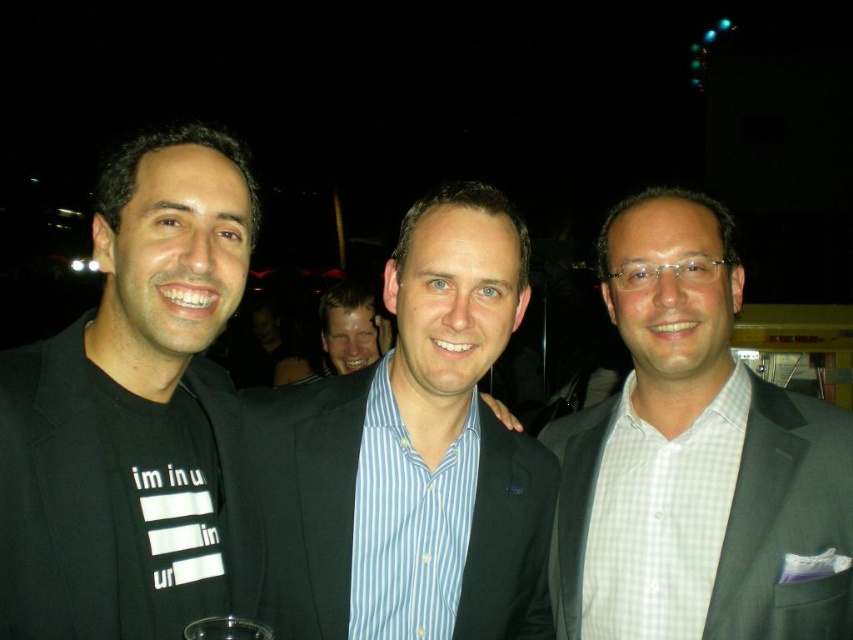
Question: Does black matte suit at center have a lesser width compared to blue striped shirt at center?

Choices:
 (A) no
 (B) yes

Answer: (B)

Question: Which object is positioned closest to the gray checkered shirt at center?

Choices:
 (A) black matte suit at center
 (B) blue striped shirt at center

Answer: (B)

Question: Which object is closer to the camera taking this photo?

Choices:
 (A) black matte suit at center
 (B) gray checkered shirt at center

Answer: (A)

Question: Observing the image, what is the correct spatial positioning of black matte suit at center in reference to gray checkered shirt at center?

Choices:
 (A) right
 (B) left

Answer: (B)

Question: Which point is farther from the camera taking this photo?

Choices:
 (A) (287, 538)
 (B) (125, 163)

Answer: (A)

Question: Considering the relative positions of black matte suit at center and blue striped shirt at center in the image provided, where is black matte suit at center located with respect to blue striped shirt at center?

Choices:
 (A) below
 (B) above

Answer: (B)